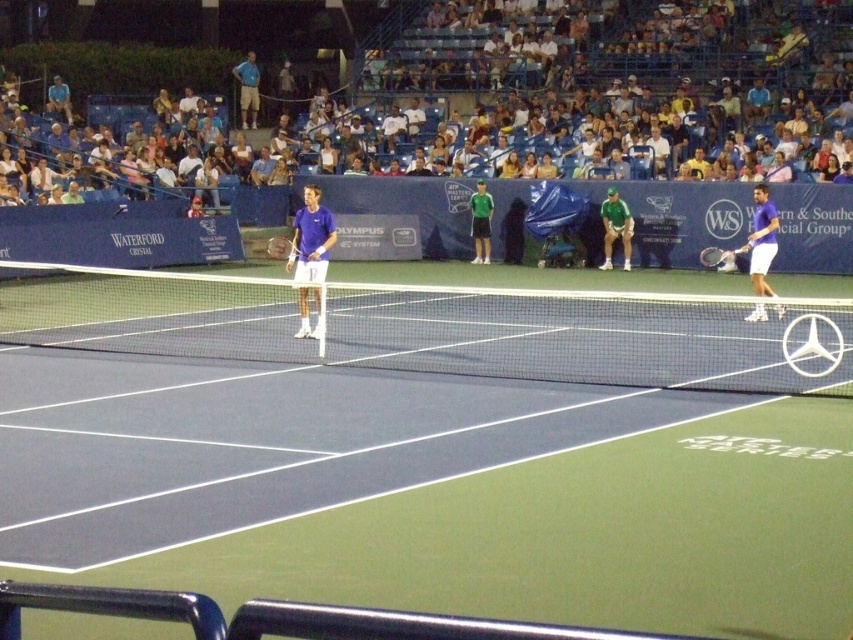
Question: Among these points, which one is farthest from the camera?

Choices:
 (A) (630, 300)
 (B) (479, 218)

Answer: (B)

Question: Is blue fabric shirt at upper center wider than black matte tennis racket at right?

Choices:
 (A) no
 (B) yes

Answer: (A)

Question: Observing the image, what is the correct spatial positioning of blue synthetic surface at center in reference to black matte tennis racket at right?

Choices:
 (A) left
 (B) right

Answer: (A)

Question: From the image, what is the correct spatial relationship of purple fabric tennis racket at center in relation to purple matte tennis racket at right?

Choices:
 (A) below
 (B) above

Answer: (B)

Question: Which is farther from the blue synthetic surface at center?

Choices:
 (A) blue fabric shirt at upper center
 (B) white cotton shirt at upper center
 (C) black matte tennis racket at right
 (D) white mesh net at center

Answer: (A)

Question: Which point appears closest to the camera in this image?

Choices:
 (A) (749, 243)
 (B) (612, 60)
 (C) (285, 248)

Answer: (A)